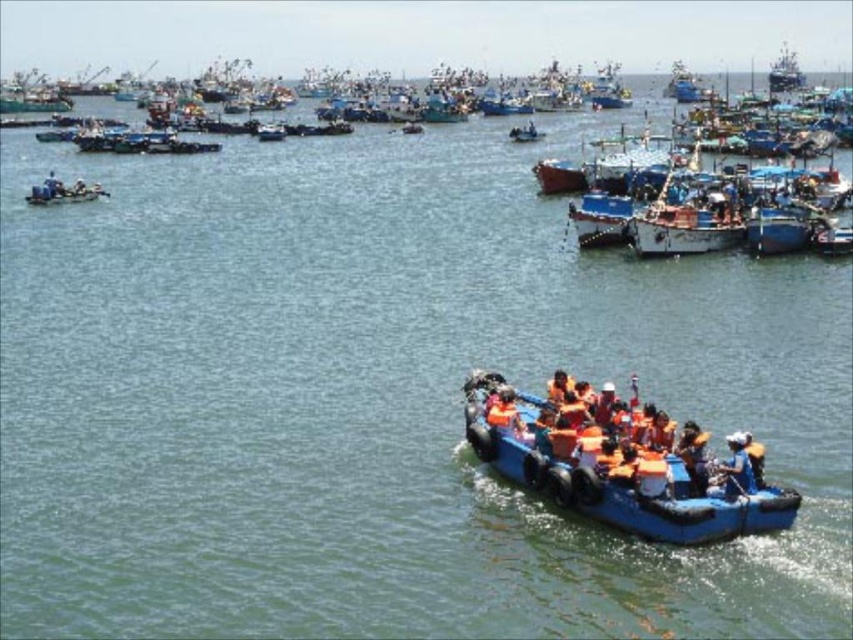
You are a safety inspector checking the harbor scene. You need to locate the orange life vest at center. What are its coordinates?

The orange life vest at center is located at point coordinates of (735, 467).

You are a drone operator tasked with capturing aerial footage of the harbor. You need to position your drone to focus on the blue rubber boat at lower right. According to the coordinates provided, where should you direct the drone to ensure it captures the boat in the frame?

The blue rubber boat at lower right is located at coordinates point (608, 468), so you should direct the drone to that point to capture the boat in the frame.